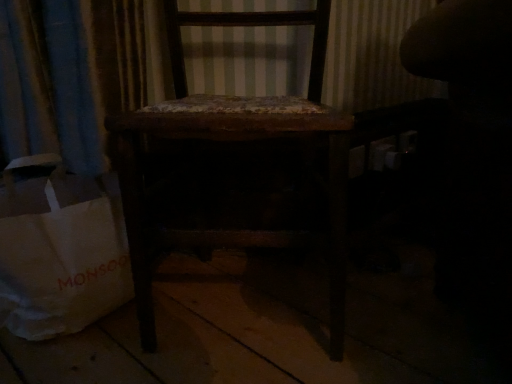
Question: Considering the positions of white paper bag at lower left and dark wood chair at center in the image, is white paper bag at lower left bigger or smaller than dark wood chair at center?

Choices:
 (A) big
 (B) small

Answer: (B)

Question: From a real-world perspective, is white paper bag at lower left positioned above or below dark wood chair at center?

Choices:
 (A) above
 (B) below

Answer: (B)

Question: Considering the positions of point (78, 266) and point (338, 231), is point (78, 266) closer or farther from the camera than point (338, 231)?

Choices:
 (A) farther
 (B) closer

Answer: (A)

Question: Is dark wood chair at center wider or thinner than white paper bag at lower left?

Choices:
 (A) thin
 (B) wide

Answer: (B)

Question: Is dark wood chair at center bigger or smaller than white paper bag at lower left?

Choices:
 (A) small
 (B) big

Answer: (B)

Question: Is point (310, 23) closer or farther from the camera than point (83, 251)?

Choices:
 (A) closer
 (B) farther

Answer: (B)

Question: From a real-world perspective, relative to white paper bag at lower left, is dark wood chair at center vertically above or below?

Choices:
 (A) below
 (B) above

Answer: (B)